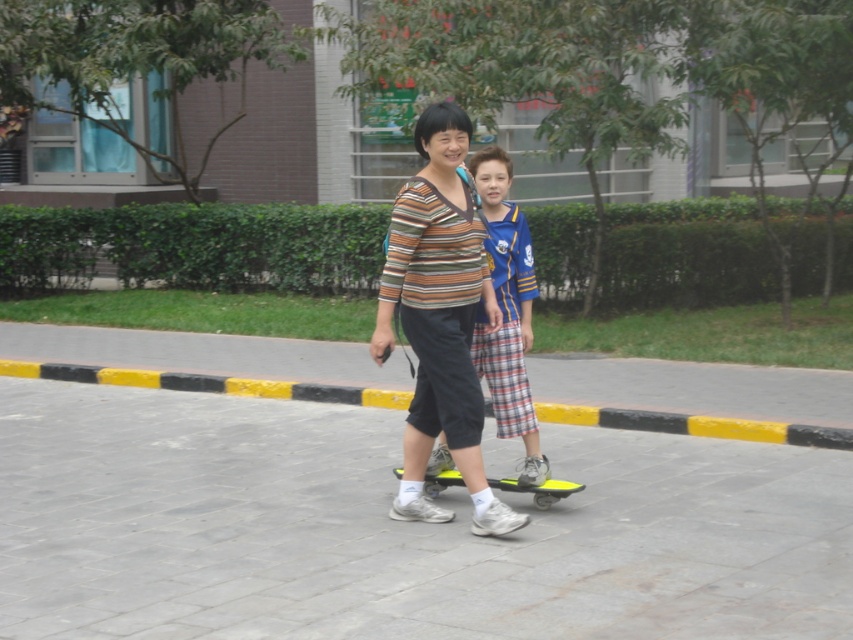
Is point (480, 490) positioned behind point (683, 429)?

No, it is not.

Consider the image. Does striped fabric shirt at center have a greater width compared to yellow/black striped curb at lower center?

Indeed, striped fabric shirt at center has a greater width compared to yellow/black striped curb at lower center.

Who is more distant from viewer, (404, 502) or (344, 401)?

The point (344, 401) is more distant.

Image resolution: width=853 pixels, height=640 pixels. In order to click on striped fabric shirt at center in this screenshot , I will do pos(440,317).

Can you confirm if yellow rubber mat at center is positioned to the right of striped fabric shirt at center?

Incorrect, yellow rubber mat at center is not on the right side of striped fabric shirt at center.

Can you confirm if yellow rubber mat at center is wider than striped fabric shirt at center?

Yes, yellow rubber mat at center is wider than striped fabric shirt at center.

Describe the element at coordinates (393, 529) in the screenshot. I see `yellow rubber mat at center` at that location.

You are a GUI agent. You are given a task and a screenshot of the screen. Output one action in this format:
    pyautogui.click(x=<x>, y=<y>)
    Task: Click on the yellow rubber mat at center
    The image size is (853, 640).
    Given the screenshot: What is the action you would take?
    pyautogui.click(x=393, y=529)

Is striped fabric shirt at center positioned at the back of yellow matte skateboard at center?

No.

Image resolution: width=853 pixels, height=640 pixels. Describe the element at coordinates (440, 317) in the screenshot. I see `striped fabric shirt at center` at that location.

Is point (422, 296) in front of point (436, 486)?

Yes, point (422, 296) is in front of point (436, 486).

Where is `striped fabric shirt at center`? This screenshot has width=853, height=640. striped fabric shirt at center is located at coordinates (440, 317).